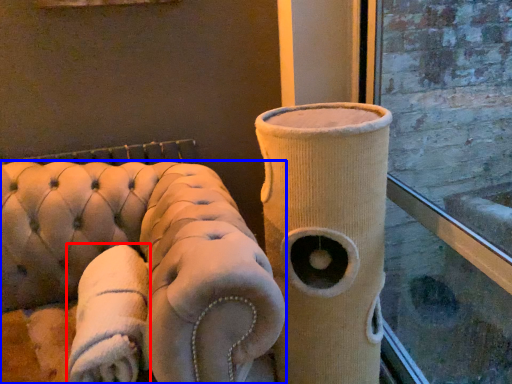
Question: Which point is closer to the camera, cloth (highlighted by a red box) or furniture (highlighted by a blue box)?

Choices:
 (A) cloth
 (B) furniture

Answer: (B)